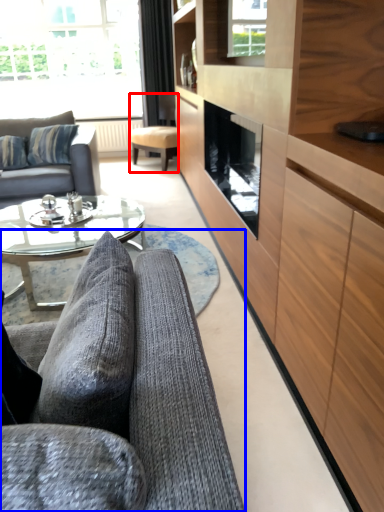
Question: Which of the following is the closest to the observer, chair (highlighted by a red box) or studio couch (highlighted by a blue box)?

Choices:
 (A) chair
 (B) studio couch

Answer: (B)